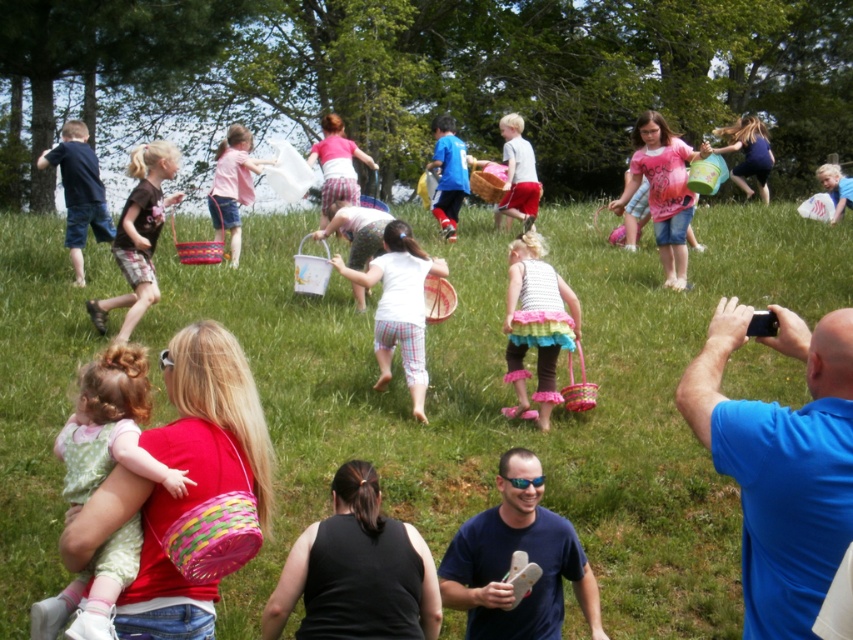
You are a child participating in an Easter egg hunt. You see the green grassy field at center and the pink fabric basket at center. Which object is closer to you?

The green grassy field at center is closer to you because it is in front of the pink fabric basket at center.

Based on the scene description, where is the pink fabric dress at center located in terms of coordinates?

The pink fabric dress at center is located at coordinates point (663, 189).